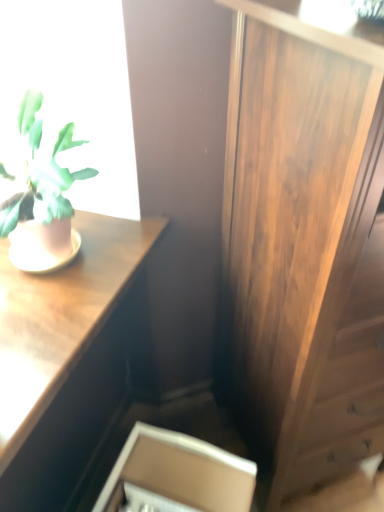
In order to click on wooden desk at upper left in this screenshot , I will do `click(64, 358)`.

At what (x,y) coordinates should I click in order to perform the action: click on white cardboard box at lower center. Please return your answer as a coordinate pair (x, y). Looking at the image, I should click on (176, 475).

What is the approximate height of matte pink pot at left?

matte pink pot at left is 13.54 inches tall.

Locate an element on the screen. This screenshot has height=512, width=384. pink matte flowerpot at left is located at coordinates [x=43, y=245].

Based on the photo, is white cardboard box at lower center next to wooden desk at upper left?

No, white cardboard box at lower center is not next to wooden desk at upper left.

Which object is positioned more to the left, white cardboard box at lower center or wooden desk at upper left?

From the viewer's perspective, wooden desk at upper left appears more on the left side.

In the scene shown: Is white cardboard box at lower center positioned with its back to wooden desk at upper left?

Yes, wooden desk at upper left is at the back of white cardboard box at lower center.

Can you confirm if wooden desk at upper left is taller than matte pink pot at left?

Indeed, wooden desk at upper left has a greater height compared to matte pink pot at left.

Is wooden desk at upper left in front of or behind matte pink pot at left in the image?

Visually, wooden desk at upper left is located behind matte pink pot at left.

From a real-world perspective, which object rests below the other?

wooden desk at upper left, from a real-world perspective.

Would you say matte pink pot at left is to the left or to the right of wooden desk at upper left in the picture?

From the image, it's evident that matte pink pot at left is to the right of wooden desk at upper left.

Is matte pink pot at left oriented towards wooden desk at upper left?

No, matte pink pot at left is not facing towards wooden desk at upper left.

Considering the sizes of matte pink pot at left and wooden desk at upper left in the image, is matte pink pot at left wider or thinner than wooden desk at upper left?

Considering their sizes, matte pink pot at left looks slimmer than wooden desk at upper left.

How many degrees apart are the facing directions of matte pink pot at left and wooden desk at upper left?

matte pink pot at left and wooden desk at upper left are facing 0.646 degrees away from each other.

Is pink matte flowerpot at left in front of or behind wooden desk at upper left in the image?

Clearly, pink matte flowerpot at left is behind wooden desk at upper left.

Image resolution: width=384 pixels, height=512 pixels. What are the coordinates of `flowerpot on the right of wooden desk at upper left` in the screenshot? It's located at (43, 245).

Considering the sizes of pink matte flowerpot at left and wooden desk at upper left in the image, is pink matte flowerpot at left bigger or smaller than wooden desk at upper left?

pink matte flowerpot at left is smaller than wooden desk at upper left.

In the scene shown: Can you confirm if matte pink pot at left is positioned to the left of white cardboard box at lower center?

Yes, matte pink pot at left is to the left of white cardboard box at lower center.

Considering the relative sizes of matte pink pot at left and white cardboard box at lower center in the image provided, is matte pink pot at left smaller than white cardboard box at lower center?

No, matte pink pot at left is not smaller than white cardboard box at lower center.

In the scene shown: Between matte pink pot at left and white cardboard box at lower center, which one has more height?

white cardboard box at lower center is taller.

Locate an element on the screen. This screenshot has height=512, width=384. desk that is under the wooden side cabinet at right (from a real-world perspective) is located at coordinates (64, 358).

Looking at this image, would you consider wooden desk at upper left to be distant from wooden side cabinet at right?

No, wooden desk at upper left is not far from wooden side cabinet at right.

Is wooden desk at upper left facing towards wooden side cabinet at right?

Yes, wooden desk at upper left faces towards wooden side cabinet at right.

From the image's perspective, is wooden desk at upper left above or below wooden side cabinet at right?

Clearly, from the image's perspective, wooden desk at upper left is below wooden side cabinet at right.

Can you see pink matte flowerpot at left touching white cardboard box at lower center?

No, pink matte flowerpot at left is not making contact with white cardboard box at lower center.

Can you tell me how much pink matte flowerpot at left and white cardboard box at lower center differ in facing direction?

0.000261 degrees.

From the image's perspective, which object appears higher, pink matte flowerpot at left or white cardboard box at lower center?

From the image's view, pink matte flowerpot at left is above.

Locate an element on the screen. flowerpot above the white cardboard box at lower center (from the image's perspective) is located at coordinates (43, 245).

Image resolution: width=384 pixels, height=512 pixels. Find the location of `cabinetry on the right of the wooden desk at upper left`. cabinetry on the right of the wooden desk at upper left is located at coordinates (176, 475).

Find the location of a particular element. The image size is (384, 512). desk behind the matte pink pot at left is located at coordinates click(x=64, y=358).

Based on their spatial positions, is matte pink pot at left or pink matte flowerpot at left closer to white cardboard box at lower center?

The object closer to white cardboard box at lower center is pink matte flowerpot at left.

From the image, which object appears to be nearer to wooden side cabinet at right, matte pink pot at left or white cardboard box at lower center?

The object closer to wooden side cabinet at right is white cardboard box at lower center.

Estimate the real-world distances between objects in this image. Which object is further from wooden side cabinet at right, pink matte flowerpot at left or matte pink pot at left?

pink matte flowerpot at left is positioned further to the anchor wooden side cabinet at right.

Looking at this image, based on their spatial positions, is wooden desk at upper left or pink matte flowerpot at left closer to white cardboard box at lower center?

Based on the image, wooden desk at upper left appears to be nearer to white cardboard box at lower center.

From the image, which object appears to be farther from white cardboard box at lower center, wooden desk at upper left or wooden side cabinet at right?

wooden side cabinet at right is further to white cardboard box at lower center.

Considering their positions, is pink matte flowerpot at left positioned further to wooden desk at upper left than matte pink pot at left?

The object further to wooden desk at upper left is matte pink pot at left.

From the image, which object appears to be nearer to white cardboard box at lower center, pink matte flowerpot at left or wooden side cabinet at right?

wooden side cabinet at right lies closer to white cardboard box at lower center than the other object.

Estimate the real-world distances between objects in this image. Which object is closer to pink matte flowerpot at left, matte pink pot at left or wooden desk at upper left?

matte pink pot at left is closer to pink matte flowerpot at left.

Locate an element on the screen. The image size is (384, 512). flowerpot between matte pink pot at left and wooden side cabinet at right is located at coordinates (43, 245).

Find the location of `side cabinet between matte pink pot at left and white cardboard box at lower center vertically`. side cabinet between matte pink pot at left and white cardboard box at lower center vertically is located at coordinates (306, 237).

Where is `houseplant between wooden desk at upper left and wooden side cabinet at right in the horizontal direction`? The height and width of the screenshot is (512, 384). houseplant between wooden desk at upper left and wooden side cabinet at right in the horizontal direction is located at coordinates (42, 199).

Where is `desk between pink matte flowerpot at left and white cardboard box at lower center vertically`? The width and height of the screenshot is (384, 512). desk between pink matte flowerpot at left and white cardboard box at lower center vertically is located at coordinates (64, 358).